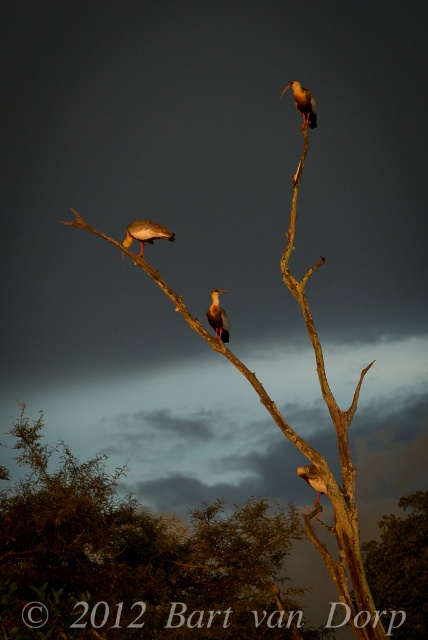
Question: Which object appears closest to the camera in this image?

Choices:
 (A) brown feathered bird at upper center
 (B) brown feathered bird at upper right

Answer: (B)

Question: Does white feathered bird at center have a lesser width compared to brown feathered bird at upper right?

Choices:
 (A) no
 (B) yes

Answer: (A)

Question: Estimate the real-world distances between objects in this image. Which object is farther from the brown feathered bird at upper right?

Choices:
 (A) matte white bird at upper left
 (B) brown rough tree trunk at center
 (C) white feathered bird at center
 (D) brown wood tree at upper center

Answer: (A)

Question: Which object is closer to the camera taking this photo?

Choices:
 (A) white feathered bird at center
 (B) brown feathered bird at upper right
 (C) brown rough tree trunk at center
 (D) matte white bird at upper left

Answer: (B)

Question: Does brown rough tree trunk at center appear on the right side of white feathered bird at center?

Choices:
 (A) no
 (B) yes

Answer: (A)

Question: Is matte white bird at upper left further to the viewer compared to white feathered bird at center?

Choices:
 (A) no
 (B) yes

Answer: (B)